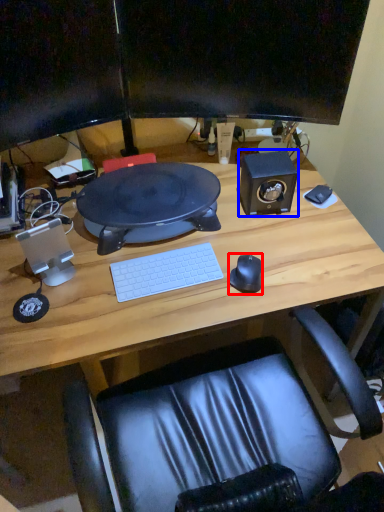
Question: Among these objects, which one is farthest to the camera, mouse (highlighted by a red box) or speaker (highlighted by a blue box)?

Choices:
 (A) mouse
 (B) speaker

Answer: (B)